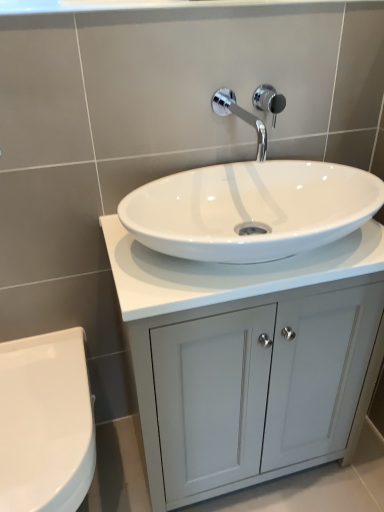
I want to click on free spot above white glossy toilet at lower left (from a real-world perspective), so click(38, 410).